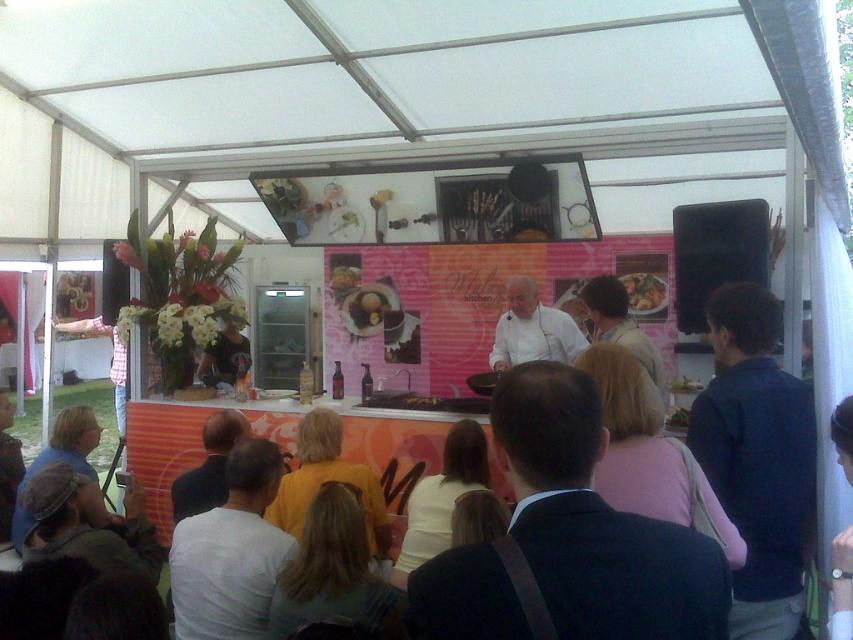
You are a spectator standing in front of the cooking demonstration area. You see both the white chef coat at center and the shiny golden plate at center. Which object is closer to you?

The white chef coat at center is closer to you than the shiny golden plate at center.

You are a participant in the cooking event and want to see the chef clearly. Considering the white chef coat at center and the shiny golden plate at center, which one is taller and might block your view?

The white chef coat at center is much taller than the shiny golden plate at center, so it might block your view.

You are attending a cooking festival and want to locate the chef. Where is the white chef coat at center located in the image?

The white chef coat at center is located at point 0.516 on the x axis and 0.625 on the y axis.